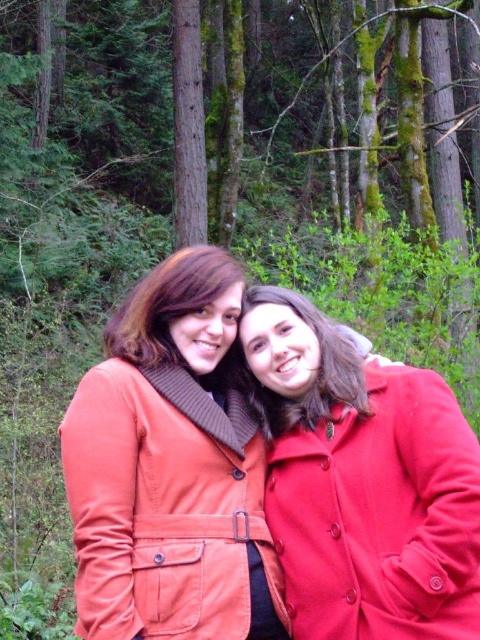
How far apart are matte red coat at center and matte brown hair at center?

matte red coat at center is 33.51 inches away from matte brown hair at center.

Between matte red coat at center and matte brown hair at center, which one has less height?

With less height is matte brown hair at center.

Is point (444, 605) behind point (199, 248)?

No, it is not.

You are a GUI agent. You are given a task and a screenshot of the screen. Output one action in this format:
    pyautogui.click(x=<x>, y=<y>)
    Task: Click on the matte red coat at center
    
    Given the screenshot: What is the action you would take?
    click(381, 515)

Looking at this image, can you confirm if matte orange coat at center is smaller than matte red coat at center?

No.

Can you confirm if matte orange coat at center is thinner than matte red coat at center?

No, matte orange coat at center is not thinner than matte red coat at center.

Is point (99, 632) farther from viewer compared to point (432, 502)?

No.

At what (x,y) coordinates should I click in order to perform the action: click on matte orange coat at center. Please return your answer as a coordinate pair (x, y). The height and width of the screenshot is (640, 480). Looking at the image, I should click on (164, 506).

Describe the element at coordinates (164, 506) in the screenshot. This screenshot has height=640, width=480. I see `matte orange coat at center` at that location.

Is matte orange coat at center thinner than matte brown hair at center?

Incorrect, matte orange coat at center's width is not less than matte brown hair at center's.

At what (x,y) coordinates should I click in order to perform the action: click on matte orange coat at center. Please return your answer as a coordinate pair (x, y). Image resolution: width=480 pixels, height=640 pixels. Looking at the image, I should click on (164, 506).